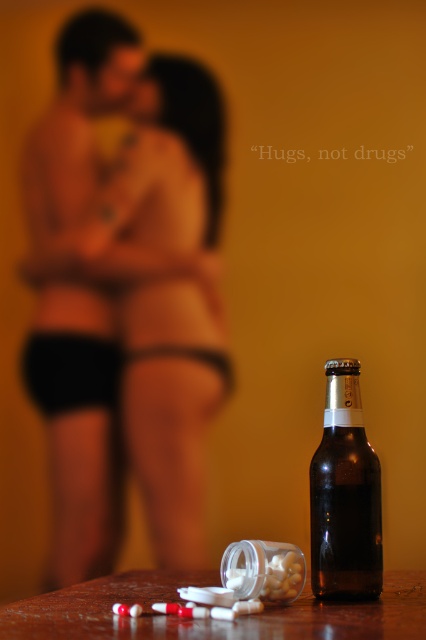
Which is more to the right, wooden table at lower center or brown glass bottle at lower right?

brown glass bottle at lower right is more to the right.

Between wooden table at lower center and brown glass bottle at lower right, which one has less height?

wooden table at lower center is shorter.

Who is more forward, (49, 636) or (359, 449)?

Point (49, 636)

Find the location of a particular element. The height and width of the screenshot is (640, 426). wooden table at lower center is located at coordinates (210, 618).

Is matte black man at center taller than brown glass bottle at lower right?

Yes, matte black man at center is taller than brown glass bottle at lower right.

Which of these two, matte black man at center or brown glass bottle at lower right, stands shorter?

brown glass bottle at lower right is shorter.

Which is behind, point (123, 276) or point (344, 496)?

Positioned behind is point (123, 276).

The image size is (426, 640). Find the location of `matte black man at center`. matte black man at center is located at coordinates (86, 288).

Is matte black man at center in front of wooden table at lower center?

No.

This screenshot has width=426, height=640. Describe the element at coordinates (86, 288) in the screenshot. I see `matte black man at center` at that location.

Which is in front, point (101, 154) or point (359, 630)?

Point (359, 630)

Where is `matte black man at center`? matte black man at center is located at coordinates (86, 288).